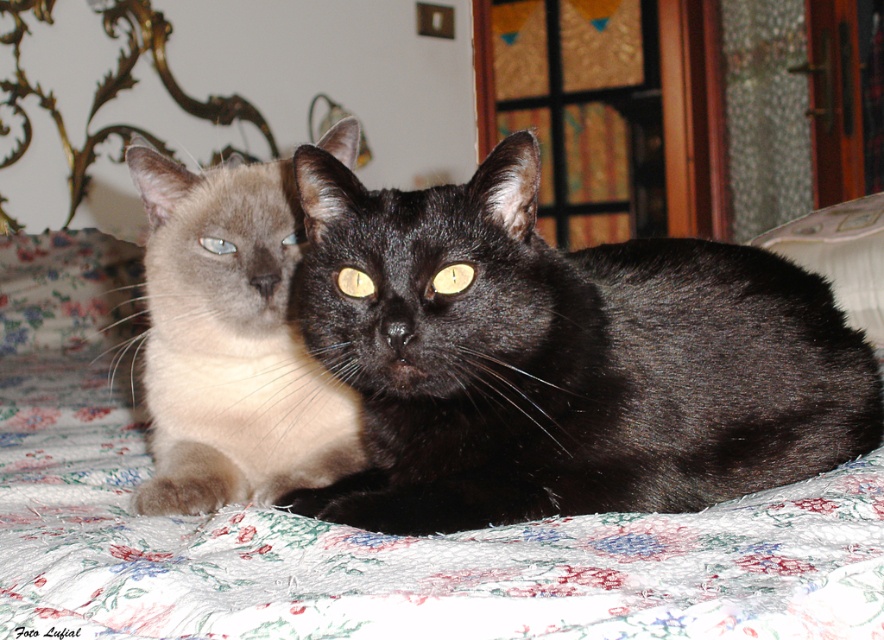
You are a photographer trying to capture the black glossy cat at center in the image. The camera is set to focus at point coordinates of 0.5, 0.5. Will the cat be in focus?

The black glossy cat at center is at point coordinates of (560, 358), which is slightly offset from the camera focus point of (442, 320). Therefore, the cat may not be perfectly in focus.

You are a photographer trying to capture both cats in a single shot. Given that the black glossy cat at center is positioned closer to the camera than the matte cream cat at center, which cat will appear larger in the photo?

The black glossy cat at center will appear larger in the photo because it is closer to the camera than the matte cream cat at center.